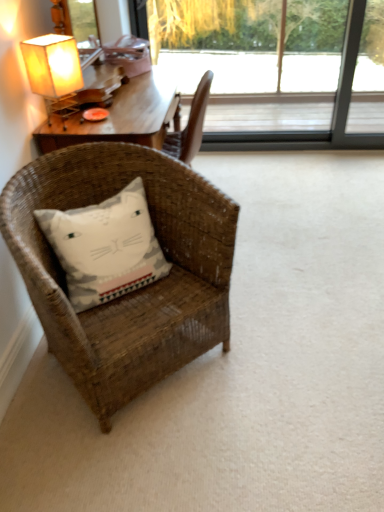
Question: Is white cotton pillow with cat design at lower left at the back of woven brown chair at lower left?

Choices:
 (A) no
 (B) yes

Answer: (B)

Question: Is woven brown chair at lower left in front of white cotton pillow with cat design at lower left?

Choices:
 (A) no
 (B) yes

Answer: (B)

Question: Is woven brown chair at lower left positioned beyond the bounds of white cotton pillow with cat design at lower left?

Choices:
 (A) no
 (B) yes

Answer: (B)

Question: Is woven brown chair at lower left taller than white cotton pillow with cat design at lower left?

Choices:
 (A) no
 (B) yes

Answer: (B)

Question: From a real-world perspective, is woven brown chair at lower left beneath white cotton pillow with cat design at lower left?

Choices:
 (A) yes
 (B) no

Answer: (A)

Question: Is white cotton pillow with cat design at lower left taller or shorter than woven brown chair at lower left?

Choices:
 (A) tall
 (B) short

Answer: (B)

Question: Considering the relative positions of white cotton pillow with cat design at lower left and woven brown chair at lower left in the image provided, is white cotton pillow with cat design at lower left to the left or to the right of woven brown chair at lower left?

Choices:
 (A) right
 (B) left

Answer: (B)

Question: From the image's perspective, is white cotton pillow with cat design at lower left located above or below woven brown chair at lower left?

Choices:
 (A) above
 (B) below

Answer: (A)

Question: In terms of size, does white cotton pillow with cat design at lower left appear bigger or smaller than woven brown chair at lower left?

Choices:
 (A) small
 (B) big

Answer: (A)

Question: From a real-world perspective, relative to woven brown chair at lower left, is matte paper lampshade at upper left vertically above or below?

Choices:
 (A) above
 (B) below

Answer: (A)

Question: Would you say matte paper lampshade at upper left is to the left or to the right of woven brown chair at lower left in the picture?

Choices:
 (A) right
 (B) left

Answer: (B)

Question: Is point (48, 96) closer or farther from the camera than point (215, 193)?

Choices:
 (A) farther
 (B) closer

Answer: (A)

Question: Considering their positions, is matte paper lampshade at upper left located in front of or behind woven brown chair at lower left?

Choices:
 (A) front
 (B) behind

Answer: (B)

Question: From their relative heights in the image, would you say woven brown chair at lower left is taller or shorter than matte paper lampshade at upper left?

Choices:
 (A) short
 (B) tall

Answer: (B)

Question: Relative to matte paper lampshade at upper left, is woven brown chair at lower left in front or behind?

Choices:
 (A) front
 (B) behind

Answer: (A)